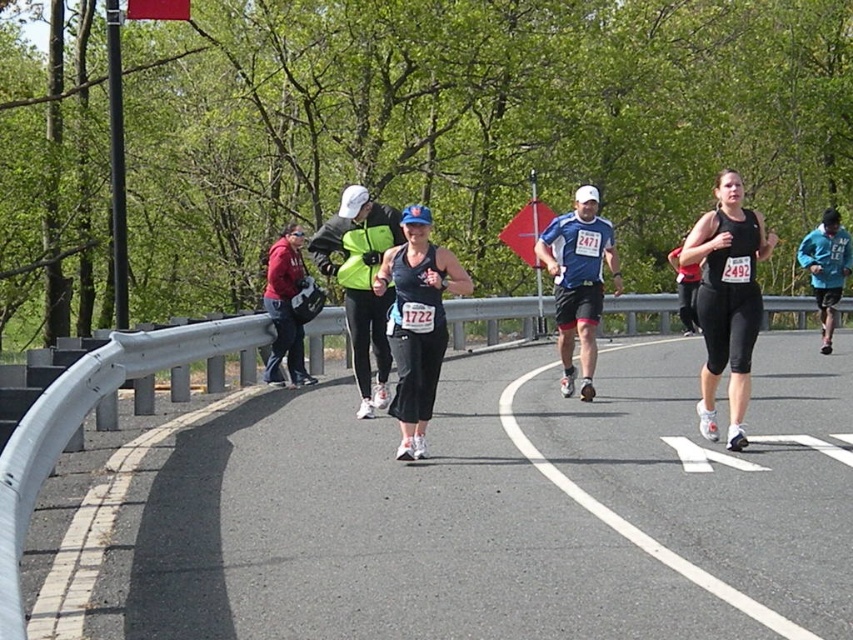
Consider the image. You are a photographer positioned at the starting line of the marathon. You want to take a photo that captures both the matte black tank top at center and the blue fabric shirt at center. Which runner will appear larger in the photo?

The matte black tank top at center will appear larger in the photo because it is closer to the viewer than the blue fabric shirt at center.

You are a photographer at the marathon event. You want to capture a photo of both the black matte running outfit at center and the matte red jacket at left in the same frame. Considering their sizes, which object should you zoom in on to ensure both are visible?

The black matte running outfit at center is wider than the matte red jacket at left, so you should zoom in on the black matte running outfit at center to ensure both are visible in the frame.